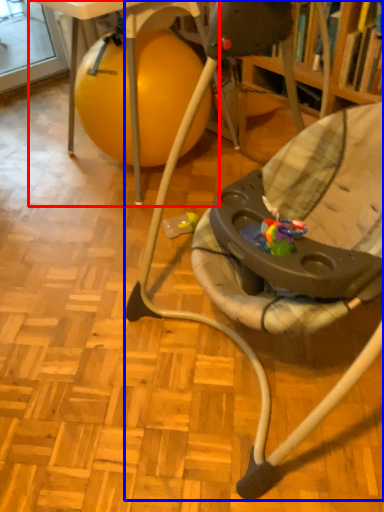
Question: Which point is closer to the camera, table (highlighted by a red box) or chair (highlighted by a blue box)?

Choices:
 (A) table
 (B) chair

Answer: (B)